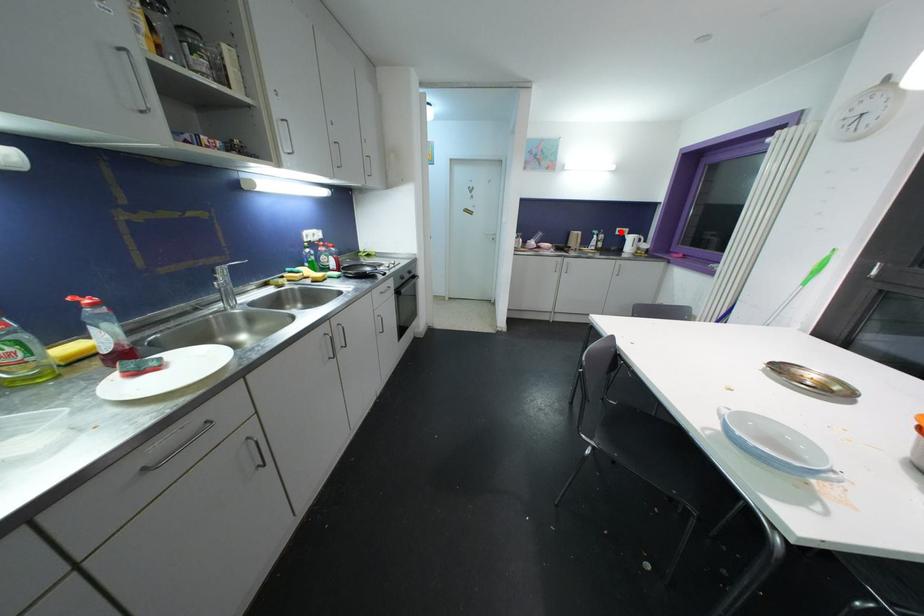
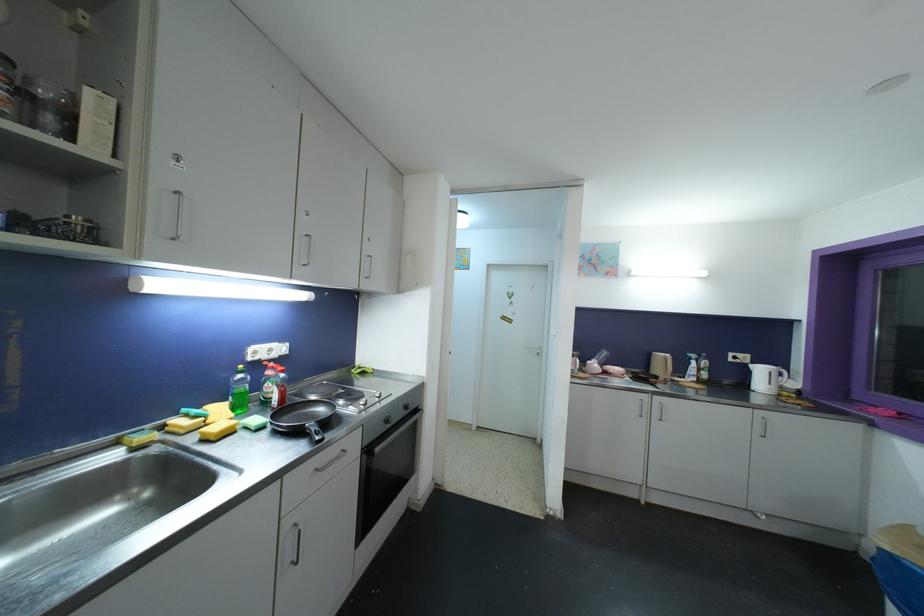
Locate, in the second image, the point that corresponds to the highlighted location in the first image.

(734, 357)